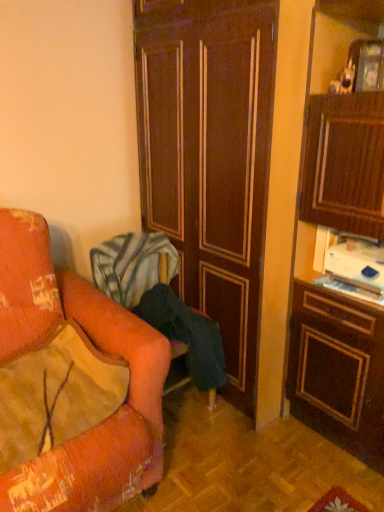
Question: Is velvet orange pillow at left beside dark wood door at center?

Choices:
 (A) yes
 (B) no

Answer: (B)

Question: Considering the relative sizes of velvet orange pillow at left and dark wood door at center in the image provided, is velvet orange pillow at left thinner than dark wood door at center?

Choices:
 (A) no
 (B) yes

Answer: (B)

Question: Can we say velvet orange pillow at left lies outside dark wood door at center?

Choices:
 (A) no
 (B) yes

Answer: (B)

Question: From the image's perspective, is velvet orange pillow at left beneath dark wood door at center?

Choices:
 (A) yes
 (B) no

Answer: (A)

Question: Considering the relative sizes of velvet orange pillow at left and dark wood door at center in the image provided, is velvet orange pillow at left wider than dark wood door at center?

Choices:
 (A) yes
 (B) no

Answer: (B)

Question: Is velvet orange pillow at left looking in the opposite direction of dark wood door at center?

Choices:
 (A) no
 (B) yes

Answer: (A)

Question: From the image's perspective, is dark wood door at center beneath velvet orange chair at left?

Choices:
 (A) no
 (B) yes

Answer: (A)

Question: Is velvet orange chair at left a part of dark wood door at center?

Choices:
 (A) yes
 (B) no

Answer: (B)

Question: Does dark wood door at center lie in front of velvet orange chair at left?

Choices:
 (A) no
 (B) yes

Answer: (B)

Question: Can you confirm if dark wood door at center is bigger than velvet orange chair at left?

Choices:
 (A) yes
 (B) no

Answer: (A)

Question: Considering the relative sizes of dark wood door at center and velvet orange chair at left in the image provided, is dark wood door at center shorter than velvet orange chair at left?

Choices:
 (A) yes
 (B) no

Answer: (B)

Question: Is dark wood door at center aimed at velvet orange chair at left?

Choices:
 (A) yes
 (B) no

Answer: (A)

Question: Is dark wood door at center closer to the viewer compared to velvet orange pillow at left?

Choices:
 (A) yes
 (B) no

Answer: (B)